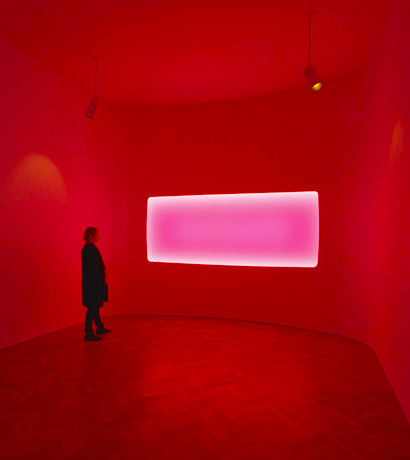
The height and width of the screenshot is (460, 410). I want to click on red floor, so click(x=252, y=391).